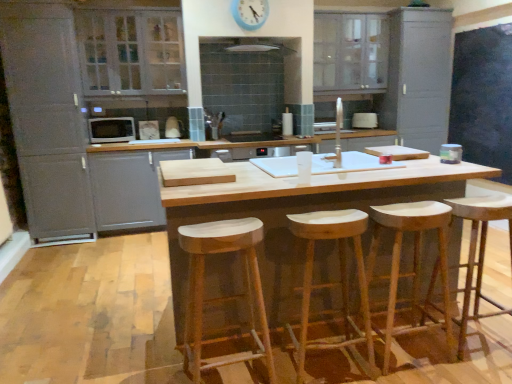
Question: From the image's perspective, is matte gray cabinet at upper right, the fifth cabinetry when ordered from left to right, located beneath matte gray cabinet at upper center, arranged as the 2th cabinetry when viewed from the right?

Choices:
 (A) no
 (B) yes

Answer: (B)

Question: Can you confirm if matte gray cabinet at upper right, placed as the first cabinetry when sorted from right to left, is positioned to the left of matte gray cabinet at upper center, arranged as the 4th cabinetry when viewed from the left?

Choices:
 (A) yes
 (B) no

Answer: (B)

Question: Is matte gray cabinet at upper right, the fifth cabinetry when ordered from left to right, not inside matte gray cabinet at upper center, arranged as the 2th cabinetry when viewed from the right?

Choices:
 (A) yes
 (B) no

Answer: (A)

Question: Is matte gray cabinet at upper right, placed as the first cabinetry when sorted from right to left, positioned before matte gray cabinet at upper center, arranged as the 4th cabinetry when viewed from the left?

Choices:
 (A) yes
 (B) no

Answer: (A)

Question: Does matte gray cabinet at upper right, placed as the first cabinetry when sorted from right to left, appear on the right side of matte gray cabinet at upper center, arranged as the 2th cabinetry when viewed from the right?

Choices:
 (A) no
 (B) yes

Answer: (B)

Question: Does matte gray cabinet at upper right, the fifth cabinetry when ordered from left to right, have a larger size compared to matte gray cabinet at upper center, arranged as the 4th cabinetry when viewed from the left?

Choices:
 (A) yes
 (B) no

Answer: (A)

Question: From the image's perspective, would you say white glossy exhaust hood at upper center is shown under matte gray cabinet at left, which is counted as the 5th cabinetry, starting from the right?

Choices:
 (A) no
 (B) yes

Answer: (A)

Question: Are white glossy exhaust hood at upper center and matte gray cabinet at left, which is counted as the 5th cabinetry, starting from the right, located far from each other?

Choices:
 (A) no
 (B) yes

Answer: (B)

Question: From the image's perspective, does white glossy exhaust hood at upper center appear higher than matte gray cabinet at left, which is counted as the 1th cabinetry, starting from the left?

Choices:
 (A) yes
 (B) no

Answer: (A)

Question: Is white glossy exhaust hood at upper center smaller than matte gray cabinet at left, which is counted as the 1th cabinetry, starting from the left?

Choices:
 (A) no
 (B) yes

Answer: (B)

Question: Can you confirm if white glossy exhaust hood at upper center is wider than matte gray cabinet at left, which is counted as the 5th cabinetry, starting from the right?

Choices:
 (A) no
 (B) yes

Answer: (A)

Question: Is matte gray cabinet at left, which is counted as the 1th cabinetry, starting from the left, at the back of white glossy exhaust hood at upper center?

Choices:
 (A) no
 (B) yes

Answer: (A)

Question: Is natural wood stool at center, the 2th stool from the right, far from white glossy microwave at left, which is the 2th appliance from back to front?

Choices:
 (A) no
 (B) yes

Answer: (B)